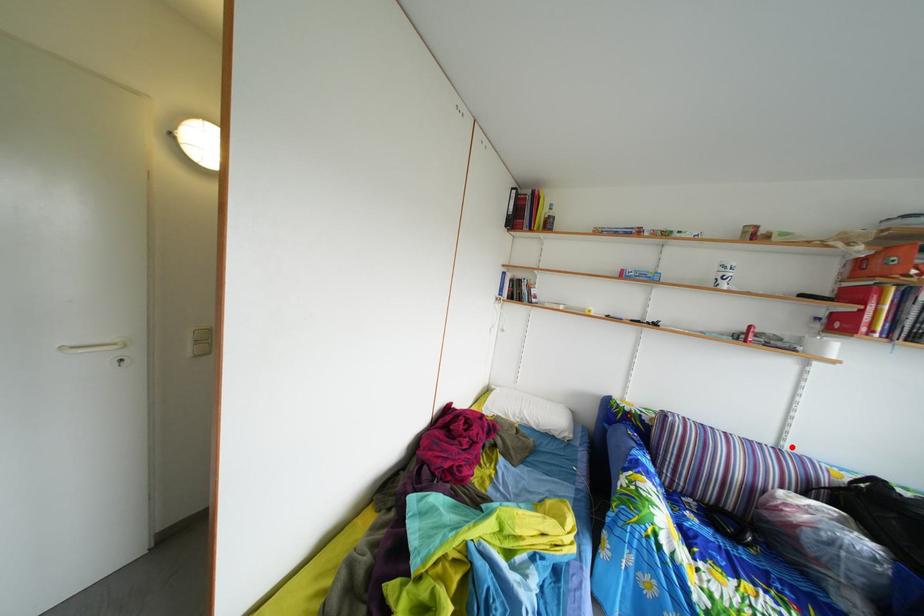
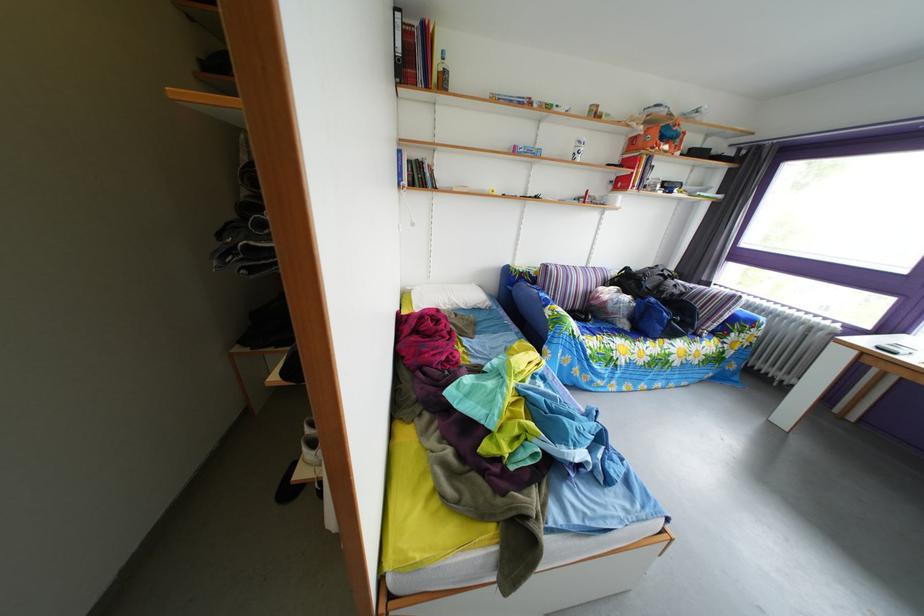
In the second image, find the point that corresponds to the highlighted location in the first image.

(599, 270)